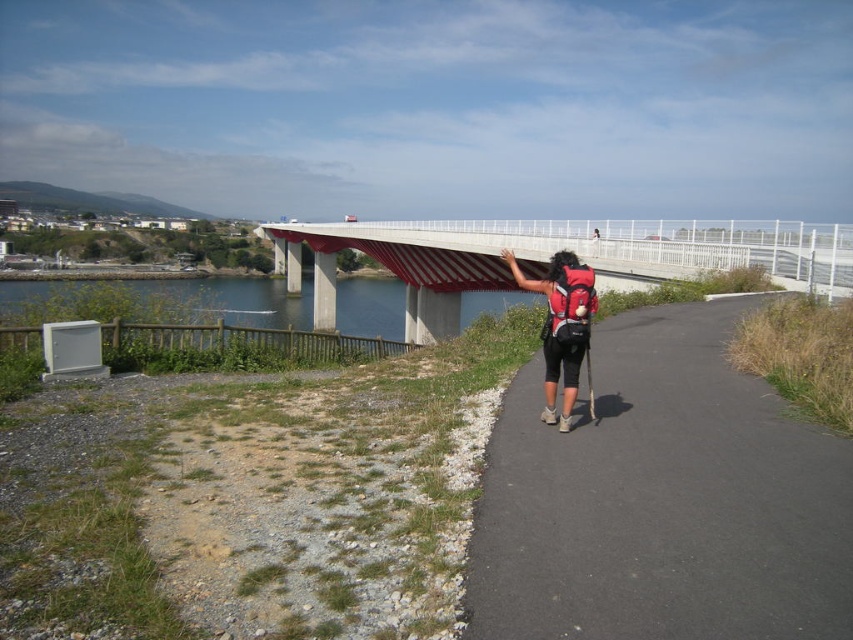
Question: Does concrete bridge at center have a greater width compared to matte red backpack at center?

Choices:
 (A) yes
 (B) no

Answer: (A)

Question: Which point appears closest to the camera in this image?

Choices:
 (A) (547, 548)
 (B) (795, 230)
 (C) (576, 275)

Answer: (A)

Question: Which is nearer to the black asphalt path at center?

Choices:
 (A) concrete bridge at center
 (B) matte red backpack at center

Answer: (B)

Question: Can you confirm if black asphalt path at center is positioned to the right of concrete bridge at center?

Choices:
 (A) no
 (B) yes

Answer: (B)

Question: Which object is closer to the camera taking this photo?

Choices:
 (A) matte red backpack at center
 (B) concrete bridge at center

Answer: (A)

Question: Is black asphalt path at center further to camera compared to concrete bridge at center?

Choices:
 (A) no
 (B) yes

Answer: (A)